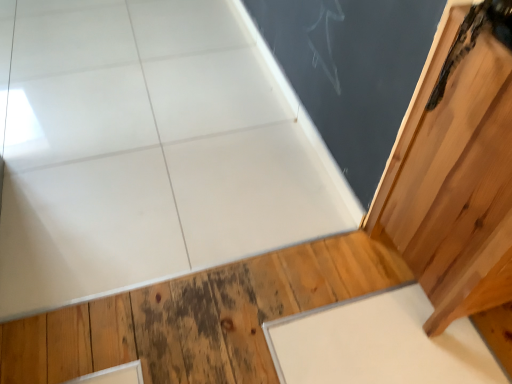
Question: Does white matte slate at lower right have a larger size compared to wooden door at upper right?

Choices:
 (A) no
 (B) yes

Answer: (A)

Question: From a real-world perspective, is white matte slate at lower right positioned under wooden door at upper right based on gravity?

Choices:
 (A) no
 (B) yes

Answer: (B)

Question: Can you confirm if white matte slate at lower right is positioned to the left of wooden door at upper right?

Choices:
 (A) yes
 (B) no

Answer: (A)

Question: Does white matte slate at lower right lie behind wooden door at upper right?

Choices:
 (A) yes
 (B) no

Answer: (A)

Question: From a real-world perspective, is white matte slate at lower right located higher than wooden door at upper right?

Choices:
 (A) no
 (B) yes

Answer: (A)

Question: Considering the positions of natural wood floor at lower right and matte black chalkboard at upper right in the image, is natural wood floor at lower right bigger or smaller than matte black chalkboard at upper right?

Choices:
 (A) small
 (B) big

Answer: (B)

Question: From the image's perspective, is natural wood floor at lower right above or below matte black chalkboard at upper right?

Choices:
 (A) above
 (B) below

Answer: (B)

Question: Would you say natural wood floor at lower right is inside or outside matte black chalkboard at upper right?

Choices:
 (A) outside
 (B) inside

Answer: (A)

Question: Is natural wood floor at lower right to the left or to the right of matte black chalkboard at upper right in the image?

Choices:
 (A) right
 (B) left

Answer: (B)

Question: Considering the positions of natural wood floor at lower right and wooden door at upper right in the image, is natural wood floor at lower right taller or shorter than wooden door at upper right?

Choices:
 (A) tall
 (B) short

Answer: (B)

Question: From the image's perspective, is natural wood floor at lower right positioned above or below wooden door at upper right?

Choices:
 (A) above
 (B) below

Answer: (B)

Question: Based on their positions, is natural wood floor at lower right located to the left or right of wooden door at upper right?

Choices:
 (A) left
 (B) right

Answer: (A)

Question: Is point (111, 307) closer or farther from the camera than point (470, 51)?

Choices:
 (A) closer
 (B) farther

Answer: (B)

Question: Is white matte slate at lower right inside the boundaries of wooden door at upper right, or outside?

Choices:
 (A) outside
 (B) inside

Answer: (A)

Question: Relative to wooden door at upper right, is white matte slate at lower right in front or behind?

Choices:
 (A) behind
 (B) front

Answer: (A)